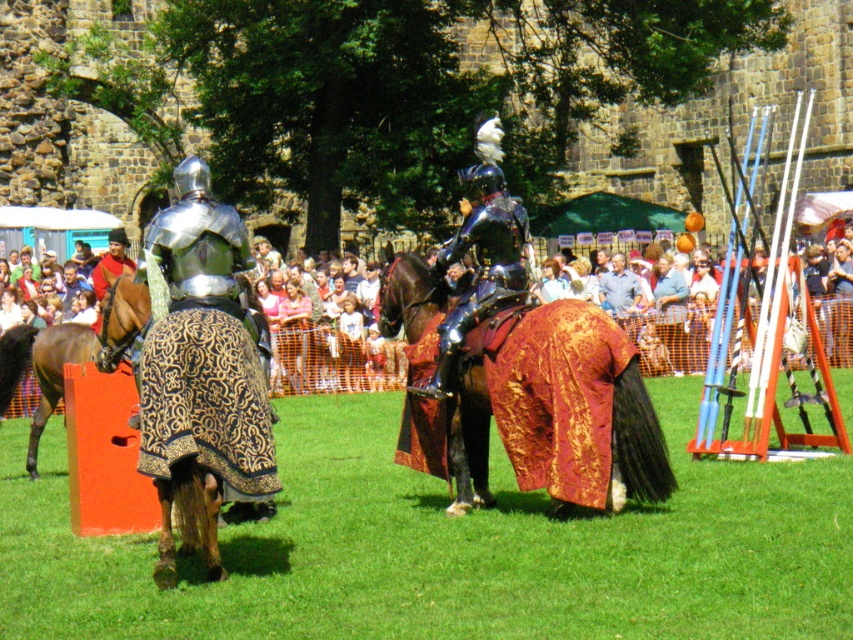
Who is higher up, golden patterned blanket at rear left or brown glossy horse at left?

golden patterned blanket at rear left is above.

Is point (245, 413) farther from camera compared to point (38, 358)?

No, (245, 413) is in front of (38, 358).

Where is `golden patterned blanket at rear left`? golden patterned blanket at rear left is located at coordinates click(x=202, y=428).

Locate an element on the screen. golden patterned blanket at rear left is located at coordinates (202, 428).

Is golden patterned blanket at rear left closer to camera compared to shiny black armor at center?

Yes, golden patterned blanket at rear left is in front of shiny black armor at center.

Based on the photo, measure the distance between point [125,284] and camera.

Point [125,284] and camera are 45.79 meters apart from each other.

Where is `golden patterned blanket at rear left`? golden patterned blanket at rear left is located at coordinates (202, 428).

Can you confirm if green grass at lower center is smaller than shiny black armor at center?

Incorrect, green grass at lower center is not smaller in size than shiny black armor at center.

Does point (769, 595) come behind point (454, 353)?

No, (769, 595) is in front of (454, 353).

In the scene shown: Who is more forward, (405, 625) or (480, 208)?

Point (405, 625)

Identify the location of green grass at lower center. (445, 548).